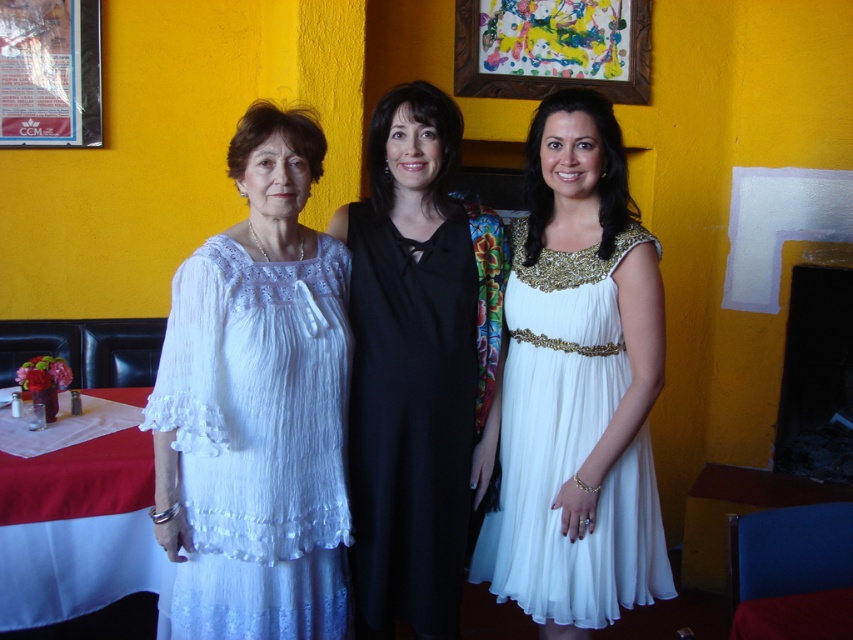
Does point (428, 525) come closer to viewer compared to point (91, 500)?

Yes.

Is black satin dress at center positioned at the back of white cloth at lower left?

No, it is in front of white cloth at lower left.

Which is behind, point (440, 337) or point (62, 576)?

Positioned behind is point (62, 576).

Locate an element on the screen. Image resolution: width=853 pixels, height=640 pixels. black satin dress at center is located at coordinates (416, 364).

Is point (463, 51) positioned after point (801, 604)?

That is True.

Does painted wood picture frame at upper center have a lesser height compared to red cloth at lower left?

In fact, painted wood picture frame at upper center may be taller than red cloth at lower left.

Describe the element at coordinates (552, 48) in the screenshot. I see `painted wood picture frame at upper center` at that location.

Where is `painted wood picture frame at upper center`? The width and height of the screenshot is (853, 640). painted wood picture frame at upper center is located at coordinates (552, 48).

Is white sheer dress at left wider than white cloth at lower left?

Indeed, white sheer dress at left has a greater width compared to white cloth at lower left.

In the scene shown: Does white sheer dress at left have a lesser width compared to white cloth at lower left?

In fact, white sheer dress at left might be wider than white cloth at lower left.

Between point (316, 332) and point (137, 403), which one is positioned behind?

Positioned behind is point (137, 403).

You are a GUI agent. You are given a task and a screenshot of the screen. Output one action in this format:
    pyautogui.click(x=<x>, y=<y>)
    Task: Click on the white sheer dress at left
    The height and width of the screenshot is (640, 853).
    Given the screenshot: What is the action you would take?
    pyautogui.click(x=256, y=442)